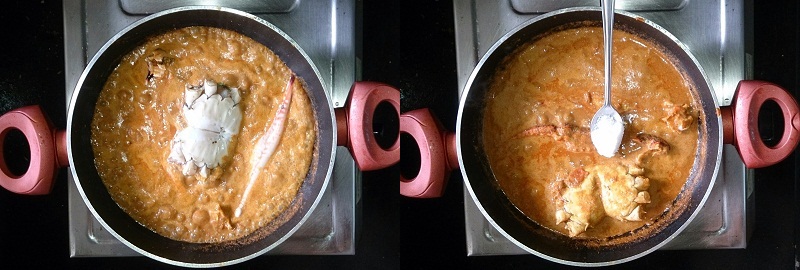
You are a GUI agent. You are given a task and a screenshot of the screen. Output one action in this format:
    pyautogui.click(x=<x>, y=<y>)
    Task: Click on the red handle for pot
    
    Given the screenshot: What is the action you would take?
    pyautogui.click(x=360, y=147), pyautogui.click(x=36, y=167), pyautogui.click(x=428, y=169), pyautogui.click(x=746, y=147)